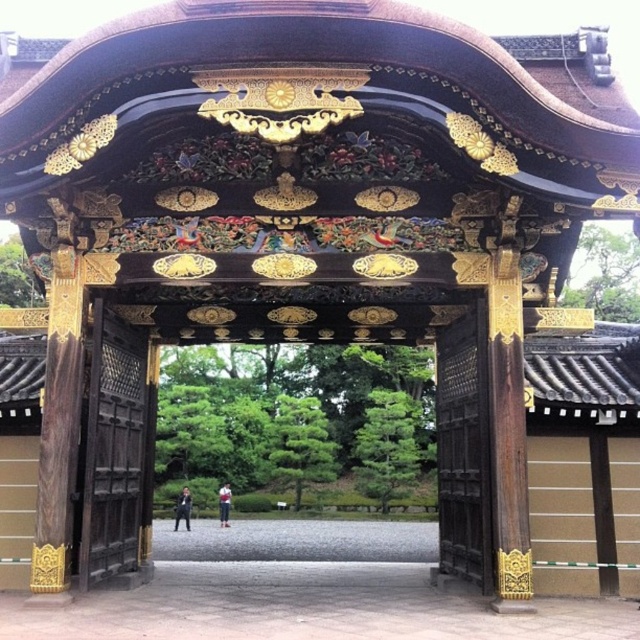
Question: Observing the image, what is the correct spatial positioning of black wood gate at center in reference to wooden gate at left?

Choices:
 (A) right
 (B) left

Answer: (A)

Question: Which object is farther from the camera taking this photo?

Choices:
 (A) dark suit at center
 (B) wooden gate at left
 (C) light blue denim jacket at center
 (D) black wood gate at center

Answer: (C)

Question: Estimate the real-world distances between objects in this image. Which object is closer to the dark suit at center?

Choices:
 (A) dark brown wooden gate at right
 (B) wooden gate at left
 (C) black wood gate at center

Answer: (C)

Question: Which point is farther to the camera?

Choices:
 (A) (484, 337)
 (B) (180, 508)

Answer: (B)

Question: Is black wood gate at center below dark suit at center?

Choices:
 (A) yes
 (B) no

Answer: (B)

Question: Is black wood gate at center bigger than dark suit at center?

Choices:
 (A) no
 (B) yes

Answer: (B)